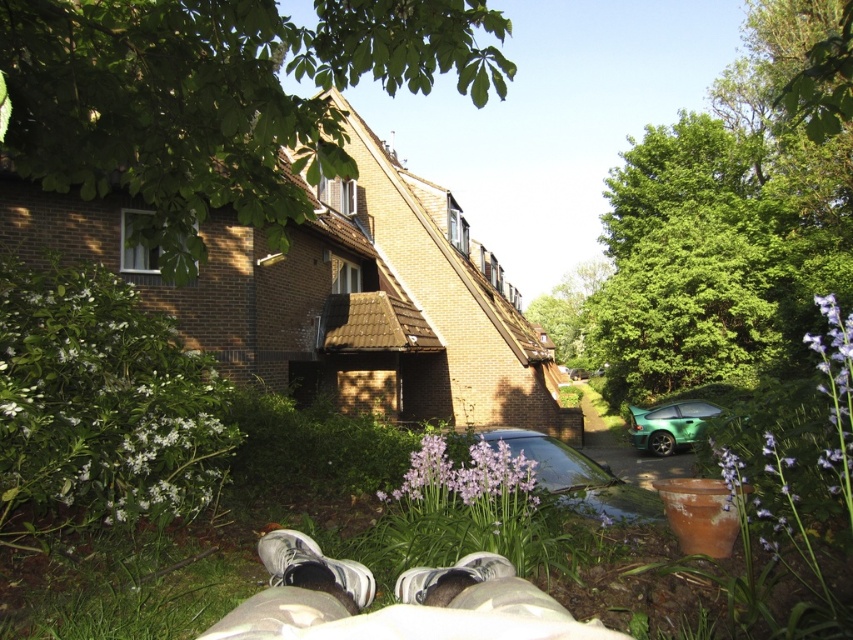
You are standing in the residential area and see the white matte bush at lower left and the purple matte flower at center. Which one is located to the left of the other?

The white matte bush at lower left is positioned on the left side of the purple matte flower at center.

From the picture: You are standing at the origin point of the coordinate system in the image. You want to walk to the green grass at lower center. What are the coordinates you need to move to?

The coordinates to move to are 0.834 in the x direction and 0.275 in the y direction.